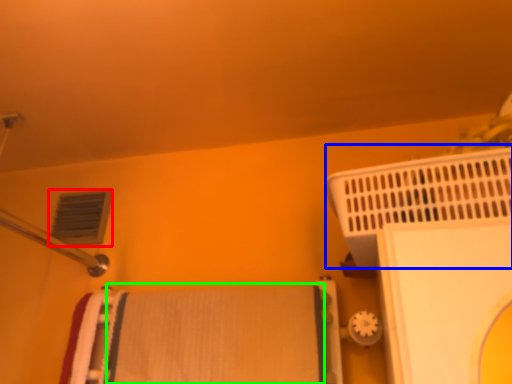
Question: Considering the real-world distances, which object is farthest from air conditioning (highlighted by a red box)? bath heater (highlighted by a blue box) or bath towel (highlighted by a green box)?

Choices:
 (A) bath heater
 (B) bath towel

Answer: (A)